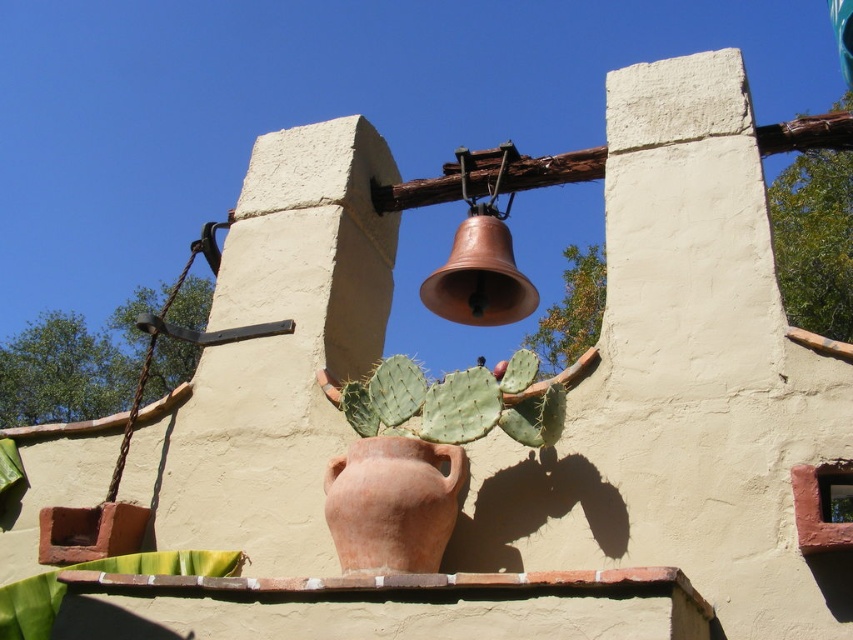
Locate an element on the screen. The width and height of the screenshot is (853, 640). terracotta pot at center is located at coordinates (393, 502).

Can you confirm if terracotta pot at center is wider than green spiky cactus at upper center?

In fact, terracotta pot at center might be narrower than green spiky cactus at upper center.

Between point (425, 490) and point (590, 310), which one is positioned behind?

The point (590, 310) is more distant.

The width and height of the screenshot is (853, 640). In order to click on terracotta pot at center in this screenshot , I will do `click(393, 502)`.

Does terracotta pot at center lie in front of green spiny cactus at center?

Yes, it is.

Which is in front, point (358, 458) or point (492, 394)?

Positioned in front is point (358, 458).

Identify the location of terracotta pot at center. The image size is (853, 640). (393, 502).

Where is `terracotta pot at center`? The image size is (853, 640). terracotta pot at center is located at coordinates (393, 502).

Can you confirm if green spiny cactus at center is taller than green spiky cactus at upper center?

No.

Is point (438, 442) less distant than point (570, 253)?

Yes, point (438, 442) is in front of point (570, 253).

Does point (506, 410) come in front of point (564, 310)?

That is True.

This screenshot has width=853, height=640. In order to click on green spiny cactus at center in this screenshot , I will do 453,403.